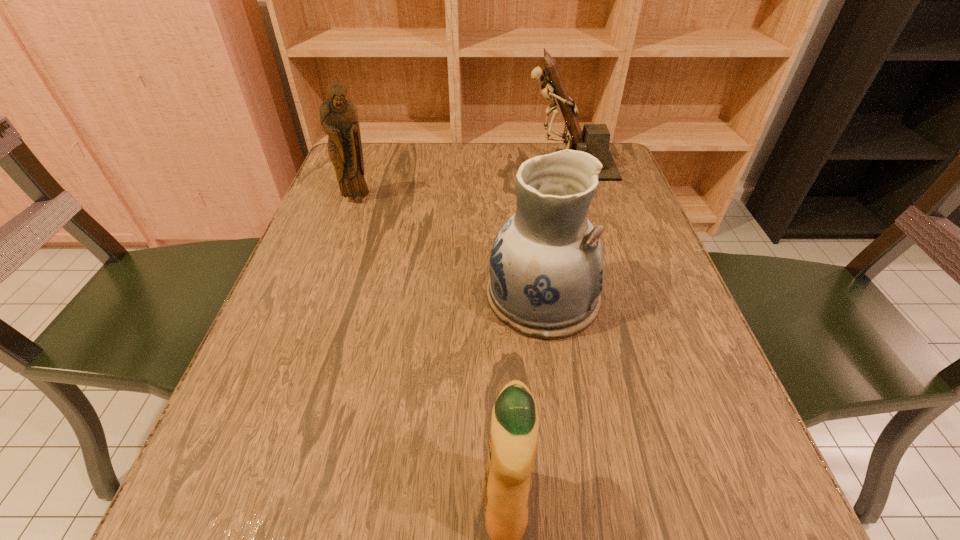
Locate an element on the screen. Image resolution: width=960 pixels, height=540 pixels. object located at the far edge is located at coordinates (594, 139).

Image resolution: width=960 pixels, height=540 pixels. What are the coordinates of `object located in the left edge section of the desktop` in the screenshot? It's located at (338, 117).

Find the location of a particular element. This screenshot has height=540, width=960. figurine located in the right edge section of the desktop is located at coordinates click(x=594, y=139).

Where is `pottery positioned at the right edge`? The height and width of the screenshot is (540, 960). pottery positioned at the right edge is located at coordinates [x=546, y=265].

You are a GUI agent. You are given a task and a screenshot of the screen. Output one action in this format:
    pyautogui.click(x=<x>, y=<y>)
    Task: Click on the object that is positioned at the far right corner
    The image size is (960, 540).
    Given the screenshot: What is the action you would take?
    click(x=594, y=139)

Where is `free space at the far edge`? free space at the far edge is located at coordinates (440, 169).

Locate an element on the screen. blank area at the left edge is located at coordinates (308, 228).

Locate an element on the screen. The height and width of the screenshot is (540, 960). vacant region at the right edge of the desktop is located at coordinates (676, 451).

This screenshot has width=960, height=540. What are the coordinates of `free space at the far left corner` in the screenshot? It's located at (384, 165).

You are a GUI agent. You are given a task and a screenshot of the screen. Output one action in this format:
    pyautogui.click(x=<x>, y=<y>)
    Task: Click on the vacant space at the far right corner of the desktop
    
    Given the screenshot: What is the action you would take?
    pyautogui.click(x=618, y=183)